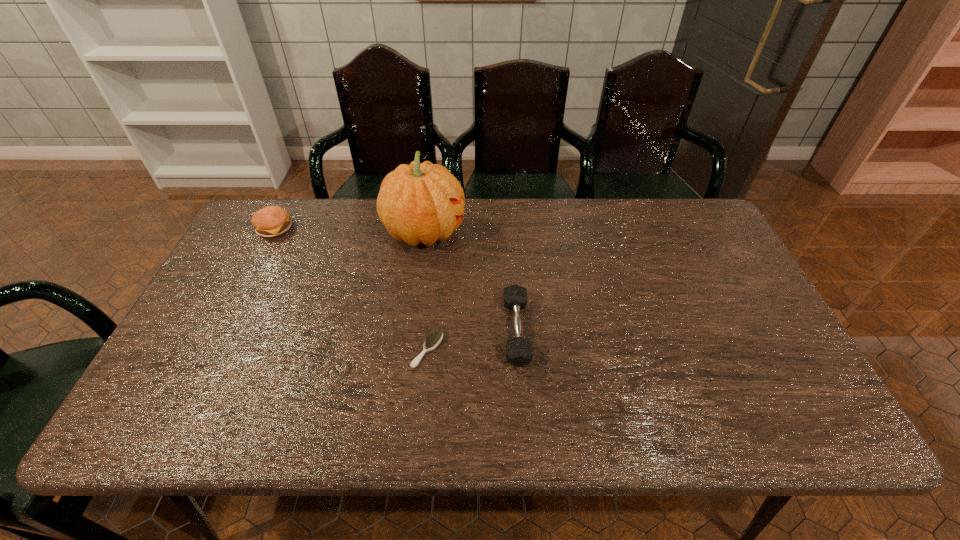
Where is `pumpkin`? Image resolution: width=960 pixels, height=540 pixels. pumpkin is located at coordinates (424, 202).

At what (x,y) coordinates should I click in order to perform the action: click on the leftmost object. Please return your answer as a coordinate pair (x, y). The image size is (960, 540). Looking at the image, I should click on tap(271, 221).

What are the coordinates of `dumbbell` in the screenshot? It's located at (519, 352).

Where is `scrubbing brush`? scrubbing brush is located at coordinates (432, 341).

Locate an element on the screen. vacant space located 0.150m on the carved face of the pumpkin is located at coordinates (512, 232).

At what (x,y) coordinates should I click in order to perform the action: click on vacant point located 0.150m on the front of the leftmost object. Please return your answer as a coordinate pair (x, y). Looking at the image, I should click on (252, 274).

The image size is (960, 540). I want to click on vacant point located 0.320m on the right of the dumbbell, so click(x=652, y=331).

Where is `blank space located 0.100m on the front of the shortest object`? This screenshot has width=960, height=540. blank space located 0.100m on the front of the shortest object is located at coordinates (421, 408).

You are a GUI agent. You are given a task and a screenshot of the screen. Output one action in this format:
    pyautogui.click(x=<x>, y=<y>)
    Task: Click on the pumpkin that is at the far edge
    
    Given the screenshot: What is the action you would take?
    pyautogui.click(x=424, y=202)

Where is `hamburger positioned at the far edge`? This screenshot has height=540, width=960. hamburger positioned at the far edge is located at coordinates (271, 221).